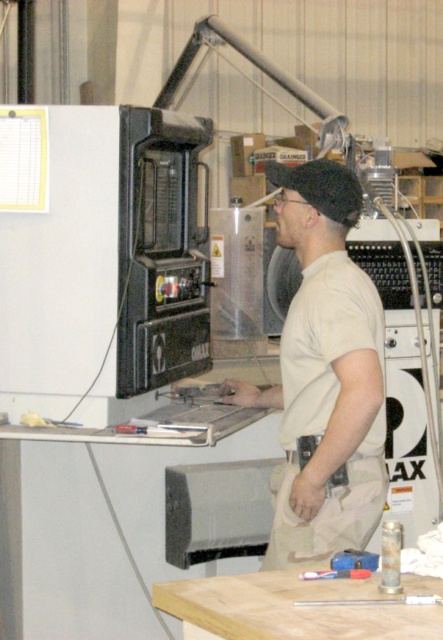
Question: Is light brown wood at lower center smaller than brushed metal screwdriver at center?

Choices:
 (A) no
 (B) yes

Answer: (A)

Question: Which point is closer to the camera?

Choices:
 (A) beige cotton shirt at center
 (B) light brown wood at lower center
 (C) metallic blue tool at lower center
 (D) brushed metal screwdriver at center

Answer: (B)

Question: Which of the following is the closest to the observer?

Choices:
 (A) (360, 561)
 (B) (314, 573)
 (C) (339, 369)

Answer: (B)

Question: Is light brown wood at lower center to the right of brushed metal screwdriver at center from the viewer's perspective?

Choices:
 (A) no
 (B) yes

Answer: (A)

Question: Which object is closer to the camera taking this photo?

Choices:
 (A) beige cotton shirt at center
 (B) brushed metal screwdriver at center

Answer: (B)

Question: Does light brown wood at lower center appear on the right side of brushed metal screwdriver at center?

Choices:
 (A) no
 (B) yes

Answer: (A)